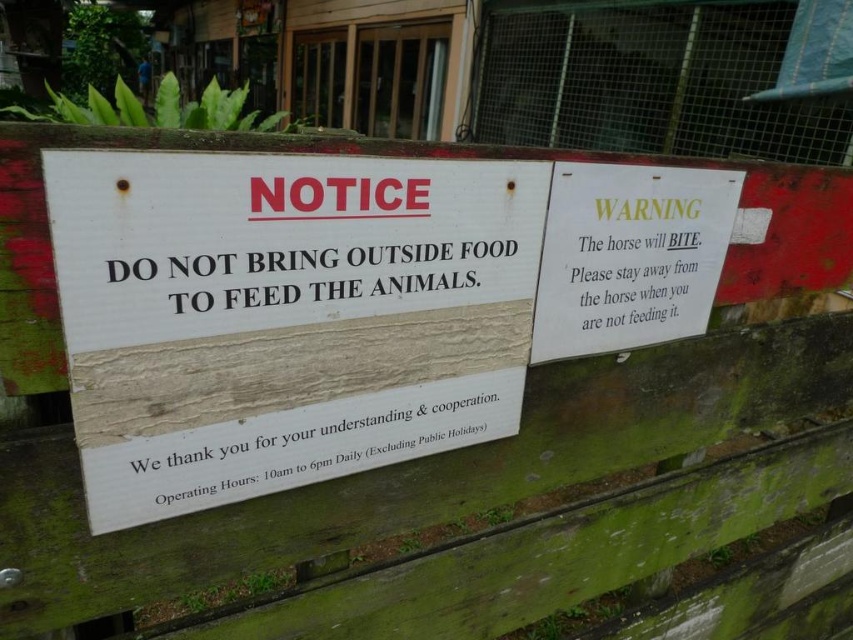
You are standing in front of the fence with two signs. There are two points marked on the image. One is at point (451, 320) and the other is at point (685, 179). Which point is closer to you?

Point (451, 320) is closer to you than point (685, 179).